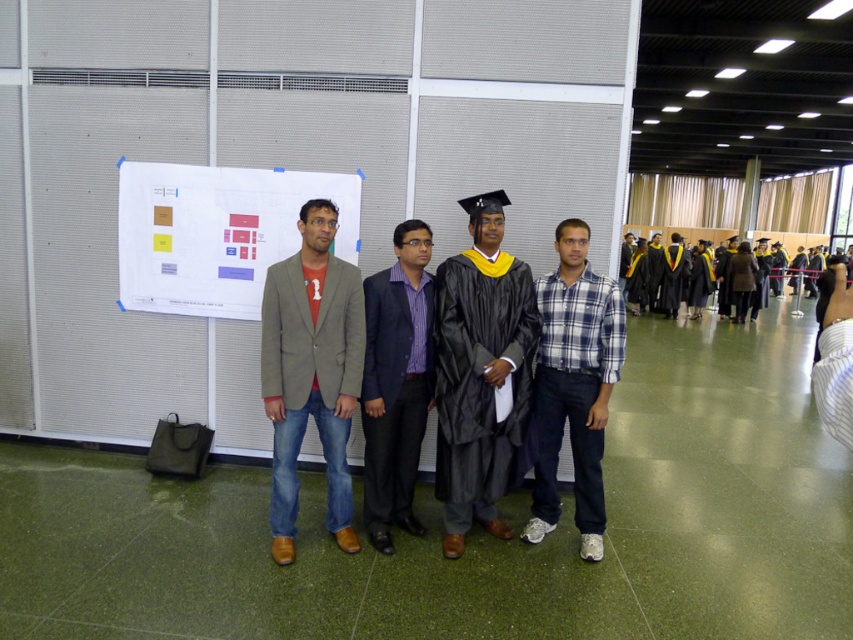
Is matte gray blazer at center to the right of purple satin blazer at center from the viewer's perspective?

No, matte gray blazer at center is not to the right of purple satin blazer at center.

Does matte gray blazer at center appear on the left side of purple satin blazer at center?

Yes, matte gray blazer at center is to the left of purple satin blazer at center.

Is point (329, 214) more distant than point (374, 314)?

No, it is in front of (374, 314).

Locate an element on the screen. Image resolution: width=853 pixels, height=640 pixels. matte gray blazer at center is located at coordinates pos(311,371).

Is point (503, 376) closer to viewer compared to point (340, 484)?

Yes, point (503, 376) is closer to viewer.

Does point (494, 340) come farther from viewer compared to point (317, 273)?

Yes, it is.

Between point (471, 332) and point (276, 540), which one is positioned behind?

The point (276, 540) is behind.

You are a GUI agent. You are given a task and a screenshot of the screen. Output one action in this format:
    pyautogui.click(x=<x>, y=<y>)
    Task: Click on the black matte graduation gown at center
    Image resolution: width=853 pixels, height=640 pixels.
    Given the screenshot: What is the action you would take?
    pyautogui.click(x=480, y=372)

Based on the photo, is white paper at upper center below purple satin blazer at center?

No.

Which is above, white paper at upper center or purple satin blazer at center?

white paper at upper center is higher up.

Locate an element on the screen. This screenshot has width=853, height=640. white paper at upper center is located at coordinates (218, 232).